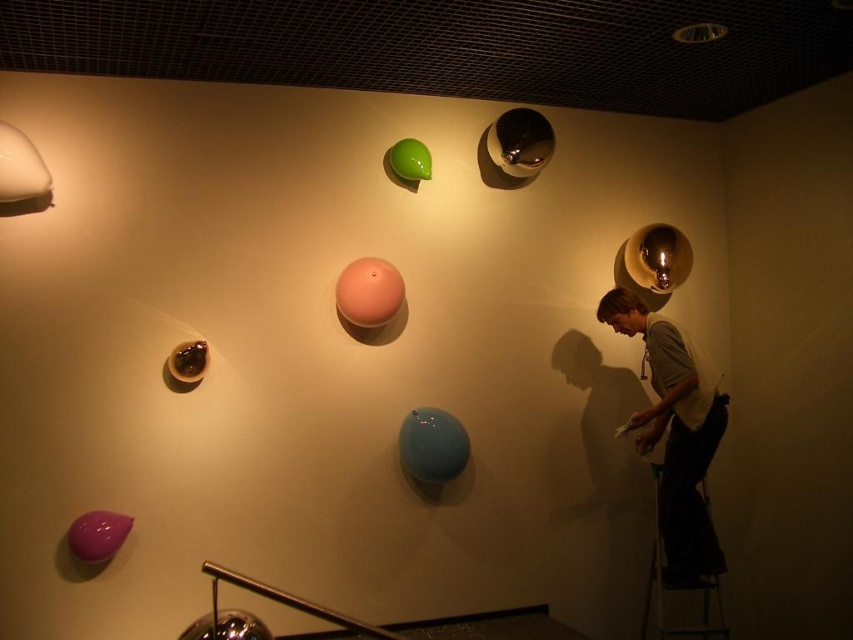
Question: Which object is closer to the camera taking this photo?

Choices:
 (A) glossy metallic lamp at upper center
 (B) purple glossy balloon at lower left
 (C) gold metallic bulb at upper right
 (D) white cotton shirt at right

Answer: (B)

Question: Is white cotton shirt at right smaller than metallic silver ladder at lower right?

Choices:
 (A) no
 (B) yes

Answer: (B)

Question: Which point is closer to the camera taking this photo?

Choices:
 (A) (412, 147)
 (B) (177, 364)
 (C) (94, 515)

Answer: (C)

Question: Is matte blue balloon at center positioned before gold metallic bulb at upper right?

Choices:
 (A) yes
 (B) no

Answer: (A)

Question: Can you confirm if glossy metallic lamp at upper center is wider than purple glossy balloon at lower left?

Choices:
 (A) no
 (B) yes

Answer: (B)

Question: Which is farther from the matte blue balloon at center?

Choices:
 (A) white cotton shirt at right
 (B) green glossy balloon at upper center
 (C) glossy black balloon at lower left
 (D) orange matte balloon at center

Answer: (B)